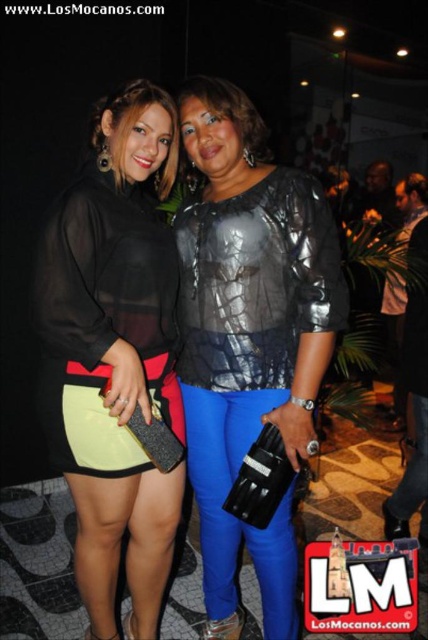
Question: Which of the following is the farthest from the observer?

Choices:
 (A) (344, 292)
 (B) (127, 227)

Answer: (B)

Question: Can you confirm if metallic silver blouse at center is smaller than matte black dress at center?

Choices:
 (A) yes
 (B) no

Answer: (B)

Question: Does metallic silver blouse at center have a smaller size compared to matte black dress at center?

Choices:
 (A) yes
 (B) no

Answer: (B)

Question: Which point is farther from the camera taking this photo?

Choices:
 (A) (169, 381)
 (B) (243, 388)

Answer: (A)

Question: In this image, where is metallic silver blouse at center located relative to matte black dress at center?

Choices:
 (A) above
 (B) below

Answer: (A)

Question: Which point appears farthest from the camera in this image?

Choices:
 (A) (246, 392)
 (B) (89, 317)

Answer: (A)